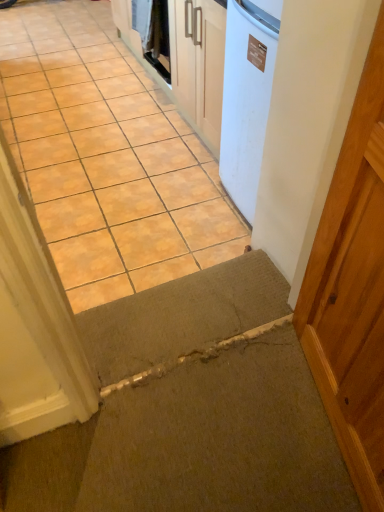
Question: From the image's perspective, would you say brown concrete at center is shown under carpeted mat at lower center?

Choices:
 (A) yes
 (B) no

Answer: (B)

Question: Could you tell me if brown concrete at center is turned towards carpeted mat at lower center?

Choices:
 (A) yes
 (B) no

Answer: (B)

Question: Is brown concrete at center shorter than carpeted mat at lower center?

Choices:
 (A) no
 (B) yes

Answer: (B)

Question: Is brown concrete at center directly adjacent to carpeted mat at lower center?

Choices:
 (A) no
 (B) yes

Answer: (A)

Question: Is the position of brown concrete at center more distant than that of carpeted mat at lower center?

Choices:
 (A) yes
 (B) no

Answer: (A)

Question: Do you think brown concrete at center is within carpeted mat at lower center, or outside of it?

Choices:
 (A) inside
 (B) outside

Answer: (B)

Question: Based on their positions, is brown concrete at center located to the left or right of carpeted mat at lower center?

Choices:
 (A) right
 (B) left

Answer: (B)

Question: From the image's perspective, is brown concrete at center positioned above or below carpeted mat at lower center?

Choices:
 (A) above
 (B) below

Answer: (A)

Question: Considering their positions, is brown concrete at center located in front of or behind carpeted mat at lower center?

Choices:
 (A) behind
 (B) front

Answer: (A)

Question: From the image's perspective, is white glossy washing machine at upper center above or below brown concrete at center?

Choices:
 (A) below
 (B) above

Answer: (B)

Question: Which is correct: white glossy washing machine at upper center is inside brown concrete at center, or outside of it?

Choices:
 (A) inside
 (B) outside

Answer: (B)

Question: Considering the positions of white glossy washing machine at upper center and brown concrete at center in the image, is white glossy washing machine at upper center bigger or smaller than brown concrete at center?

Choices:
 (A) small
 (B) big

Answer: (A)

Question: Would you say white glossy washing machine at upper center is to the left or to the right of brown concrete at center in the picture?

Choices:
 (A) right
 (B) left

Answer: (A)

Question: Relative to white glossy washing machine at upper center, is brown concrete at center in front or behind?

Choices:
 (A) behind
 (B) front

Answer: (B)

Question: From the image's perspective, is brown concrete at center above or below white glossy washing machine at upper center?

Choices:
 (A) above
 (B) below

Answer: (B)